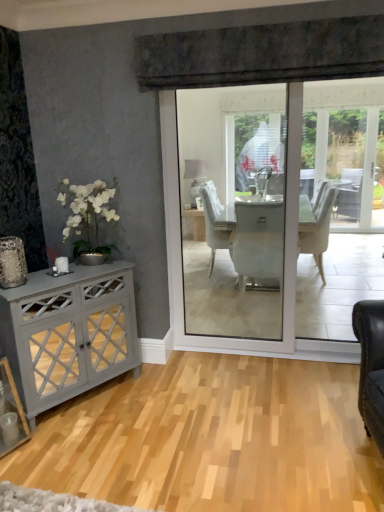
I want to click on free space in front of matte gray cabinet at left, so click(96, 454).